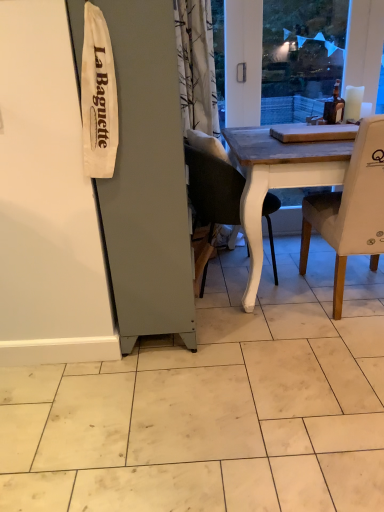
Identify the location of free space that is in between matte black chair at center, which is the second chair from right to left, and white fabric chair at right, acting as the first chair starting from the right. (277, 300).